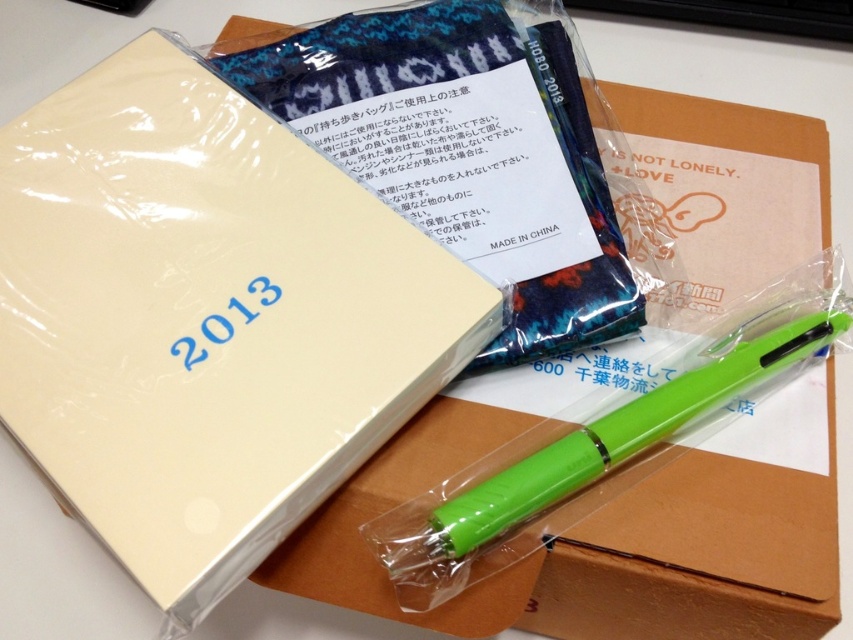
Does matte brown cardboard box at center come behind green plastic pen at lower right?

No, it is in front of green plastic pen at lower right.

Is matte brown cardboard box at center smaller than green plastic pen at lower right?

No, matte brown cardboard box at center is not smaller than green plastic pen at lower right.

This screenshot has width=853, height=640. I want to click on matte brown cardboard box at center, so click(x=601, y=545).

The width and height of the screenshot is (853, 640). Find the location of `matte brown cardboard box at center`. matte brown cardboard box at center is located at coordinates (601, 545).

Measure the distance from matte cream notepad at upper left to green plastic pen at lower right.

The distance of matte cream notepad at upper left from green plastic pen at lower right is 15.55 inches.

Which of these two, matte cream notepad at upper left or green plastic pen at lower right, stands taller?

matte cream notepad at upper left is taller.

At what (x,y) coordinates should I click in order to perform the action: click on matte cream notepad at upper left. Please return your answer as a coordinate pair (x, y). Looking at the image, I should click on click(x=206, y=320).

The width and height of the screenshot is (853, 640). I want to click on matte cream notepad at upper left, so click(206, 320).

Consider the image. Does matte cream notepad at upper left have a larger size compared to matte brown cardboard box at center?

No.

Is point (302, 177) less distant than point (773, 630)?

No.

Is point (318, 488) behind point (349, 586)?

No, (318, 488) is in front of (349, 586).

Where is `matte cream notepad at upper left`? This screenshot has height=640, width=853. matte cream notepad at upper left is located at coordinates (206, 320).